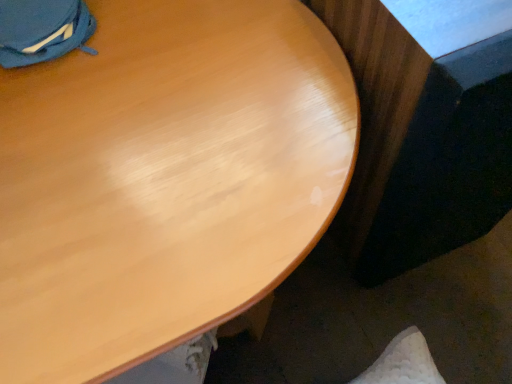
Question: Relative to glossy wood table at lower right, is glossy wood desk at upper center in front or behind?

Choices:
 (A) behind
 (B) front

Answer: (B)

Question: In terms of size, does glossy wood desk at upper center appear bigger or smaller than glossy wood table at lower right?

Choices:
 (A) small
 (B) big

Answer: (B)

Question: From the image's perspective, relative to glossy wood table at lower right, is glossy wood desk at upper center above or below?

Choices:
 (A) above
 (B) below

Answer: (B)

Question: Considering the relative positions of glossy wood table at lower right and glossy wood desk at upper center in the image provided, is glossy wood table at lower right to the left or to the right of glossy wood desk at upper center?

Choices:
 (A) right
 (B) left

Answer: (A)

Question: Choose the correct answer: Is glossy wood table at lower right inside glossy wood desk at upper center or outside it?

Choices:
 (A) inside
 (B) outside

Answer: (B)

Question: Does point (478, 218) appear closer or farther from the camera than point (99, 0)?

Choices:
 (A) closer
 (B) farther

Answer: (B)

Question: In the image, is glossy wood table at lower right positioned in front of or behind glossy wood desk at upper center?

Choices:
 (A) behind
 (B) front

Answer: (A)